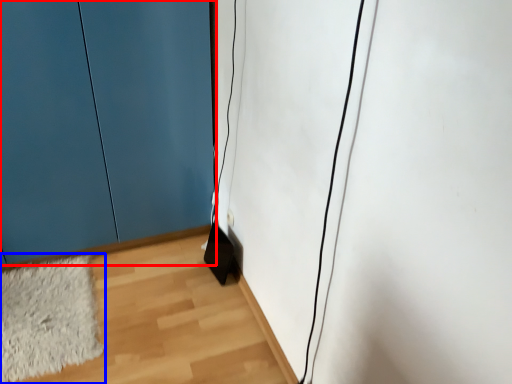
Question: Which of the following is the farthest to the observer, door (highlighted by a red box) or mat (highlighted by a blue box)?

Choices:
 (A) door
 (B) mat

Answer: (B)